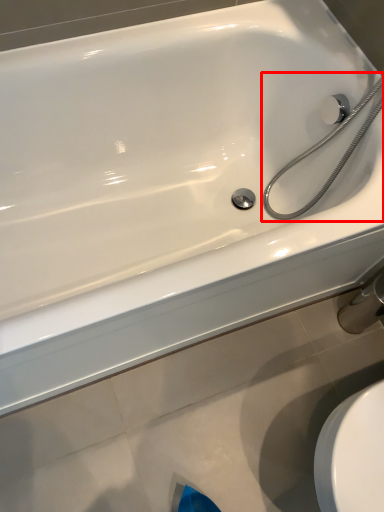
Question: In this image, where is shower (annotated by the red box) located relative to faucet?

Choices:
 (A) right
 (B) left

Answer: (B)